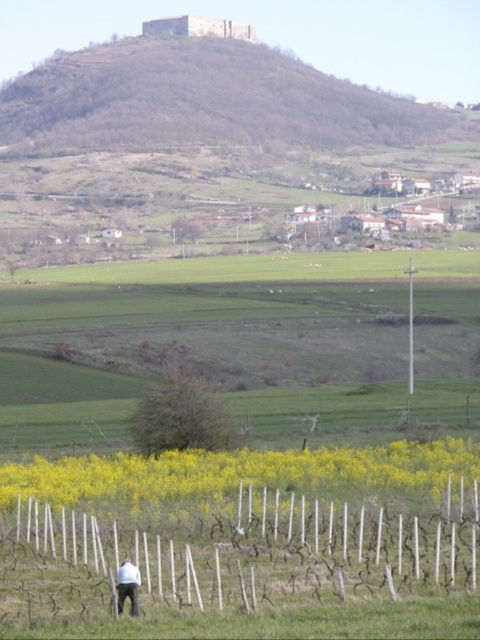
Question: Which point is closer to the camera?

Choices:
 (A) (121, 605)
 (B) (464, 454)
 (C) (300, 60)

Answer: (A)

Question: Considering the relative positions of bare earth hillside at upper center and dark blue jeans at lower center in the image provided, where is bare earth hillside at upper center located with respect to dark blue jeans at lower center?

Choices:
 (A) left
 (B) right

Answer: (A)

Question: Which of the following is the closest to the observer?

Choices:
 (A) (352, 108)
 (B) (122, 596)

Answer: (B)

Question: Is bare earth hillside at upper center wider than dark blue jeans at lower center?

Choices:
 (A) yes
 (B) no

Answer: (A)

Question: Which of the following is the farthest from the observer?

Choices:
 (A) (123, 67)
 (B) (322, 493)
 (C) (135, 566)

Answer: (A)

Question: Does bare earth hillside at upper center appear on the right side of yellow matte mustard at lower center?

Choices:
 (A) yes
 (B) no

Answer: (B)